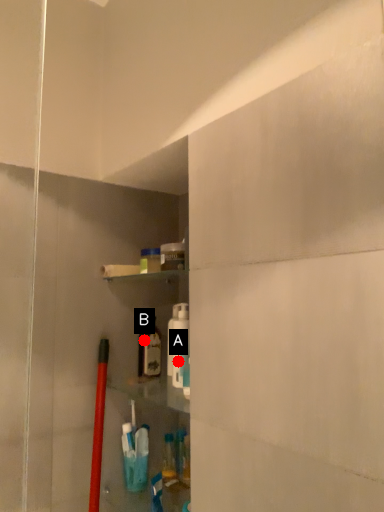
Question: Two points are circled on the image, labeled by A and B beside each circle. Which point is closer to the camera?

Choices:
 (A) A is closer
 (B) B is closer

Answer: (A)